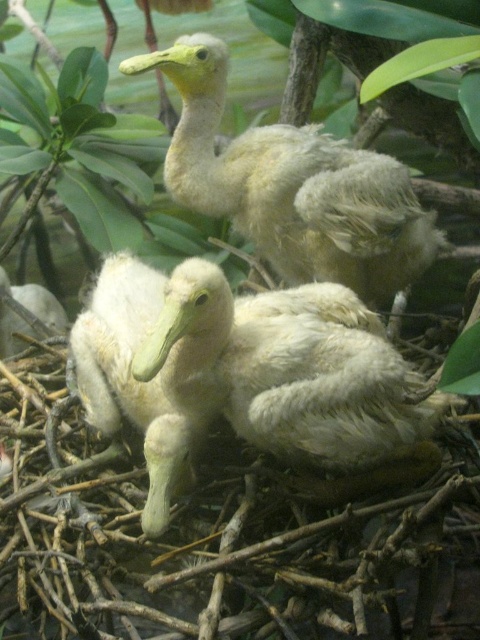
Does white fluffy duckling at center have a greater height compared to white fluffy duckling at left?

Yes, white fluffy duckling at center is taller than white fluffy duckling at left.

Does white fluffy duckling at center have a greater width compared to white fluffy duckling at left?

Indeed, white fluffy duckling at center has a greater width compared to white fluffy duckling at left.

You are a GUI agent. You are given a task and a screenshot of the screen. Output one action in this format:
    pyautogui.click(x=<x>, y=<y>)
    Task: Click on the white fluffy duckling at center
    The height and width of the screenshot is (640, 480).
    Given the screenshot: What is the action you would take?
    pyautogui.click(x=140, y=380)

Does white fluffy duck at center have a smaller size compared to soft yellow duckling at center?

Yes, white fluffy duck at center is smaller than soft yellow duckling at center.

Is white fluffy duck at center bigger than soft yellow duckling at center?

No, white fluffy duck at center is not bigger than soft yellow duckling at center.

Image resolution: width=480 pixels, height=640 pixels. Find the location of `white fluffy duck at center`. white fluffy duck at center is located at coordinates (288, 368).

Find the location of `white fluffy duck at center`. white fluffy duck at center is located at coordinates tap(288, 368).

Which is behind, point (420, 205) or point (168, 392)?

The point (420, 205) is behind.

Between soft yellow duckling at center and white fluffy duckling at center, which one has less height?

white fluffy duckling at center is shorter.

At what (x,y) coordinates should I click in order to perform the action: click on soft yellow duckling at center. Please return your answer as a coordinate pair (x, y). This screenshot has height=640, width=480. Looking at the image, I should click on (291, 186).